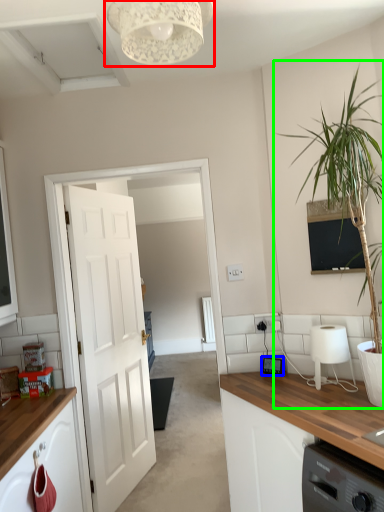
Question: Considering the real-world distances, which object is farthest from light fixture (highlighted by a red box)? home appliance (highlighted by a blue box) or houseplant (highlighted by a green box)?

Choices:
 (A) home appliance
 (B) houseplant

Answer: (A)